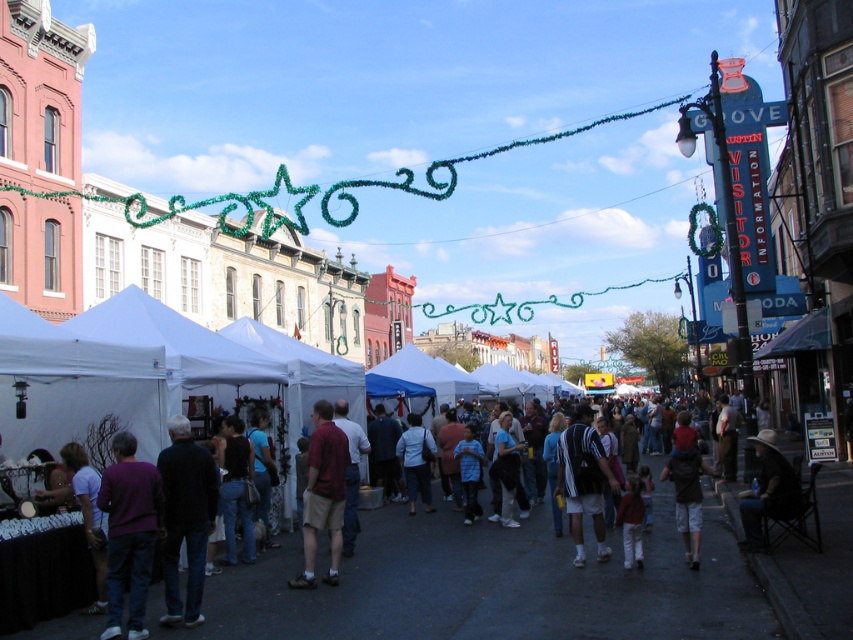
Question: Is black cotton shirt at lower left wider than matte purple shirt at lower left?

Choices:
 (A) yes
 (B) no

Answer: (A)

Question: Which point is farther to the camera?

Choices:
 (A) striped jersey at center
 (B) blue cotton shirt at center
 (C) white matte shirt at center
 (D) denim jeans at center

Answer: (C)

Question: Which object is closer to the camera taking this photo?

Choices:
 (A) denim jacket at lower right
 (B) black cotton shirt at lower left
 (C) matte purple shirt at lower left

Answer: (B)

Question: Does purple sweater at lower left appear under blue cotton shirt at center?

Choices:
 (A) no
 (B) yes

Answer: (A)

Question: Can you confirm if striped jersey at center is wider than maroon fabric shirt at center?

Choices:
 (A) yes
 (B) no

Answer: (A)

Question: Among these points, which one is nearest to the camera?

Choices:
 (A) click(x=331, y=483)
 (B) click(x=585, y=419)

Answer: (A)